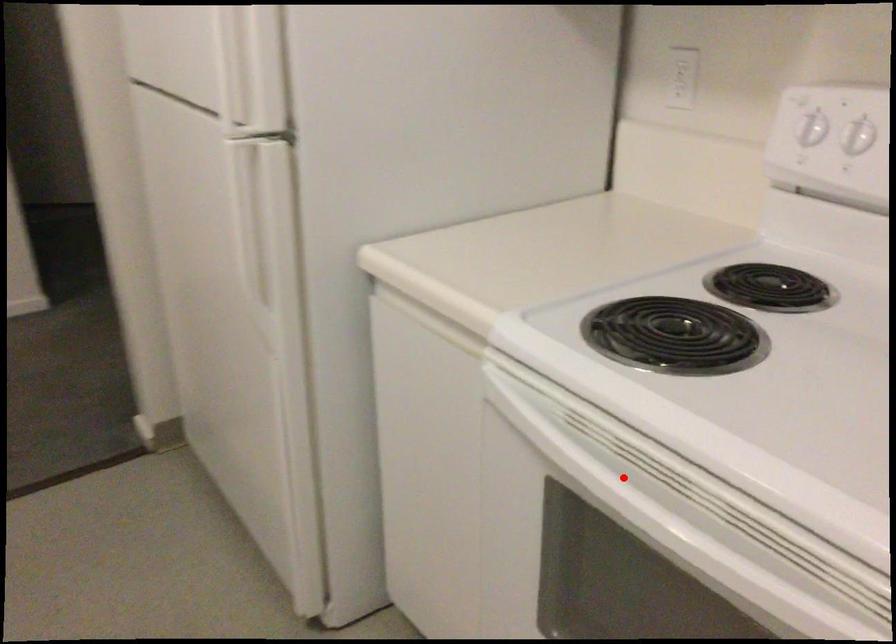
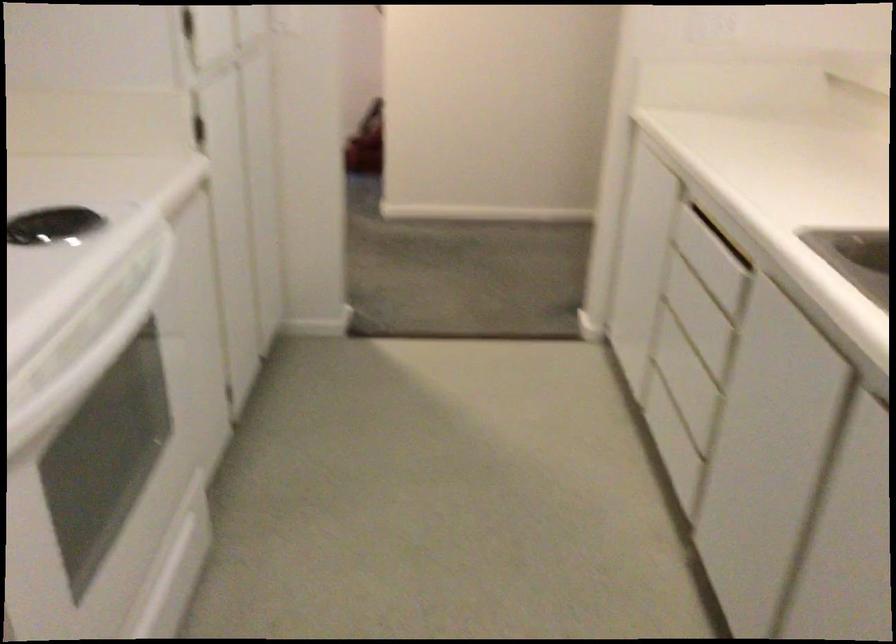
In the second image, find the point that corresponds to the highlighted location in the first image.

(89, 359)